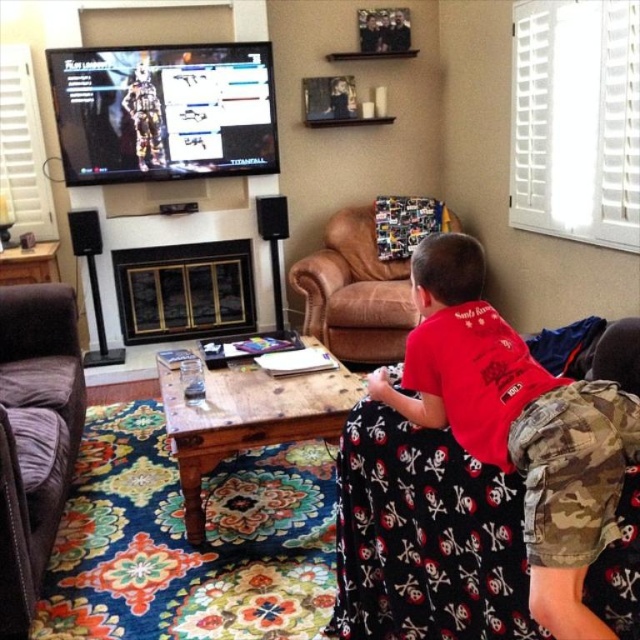
You are a parent trying to choose seating for your child. The child is wearing the red cotton shirt at lower right and needs to sit comfortably. Is the brown leather armchair at center a suitable option based on size?

The red cotton shirt at lower right has a smaller size compared to brown leather armchair at center, so the brown leather armchair at center is large enough to accommodate the child wearing the red cotton shirt at lower right comfortably.